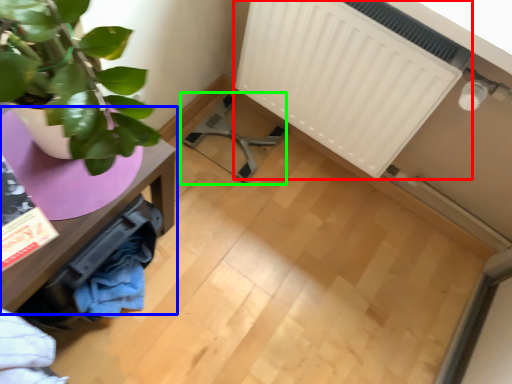
Question: Based on their relative distances, which object is nearer to radiator (highlighted by a red box)? Choose from table (highlighted by a blue box) and swivel chair (highlighted by a green box).

Choices:
 (A) table
 (B) swivel chair

Answer: (B)